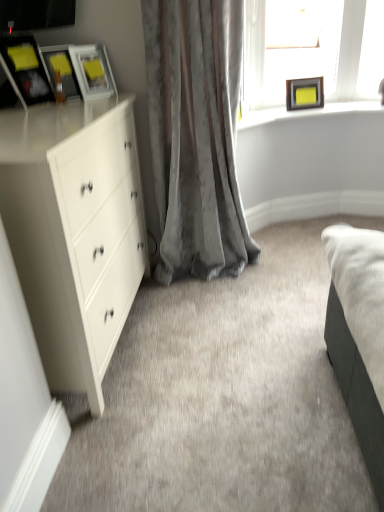
This screenshot has height=512, width=384. Identify the location of free point in front of matte black picture frame at upper left, acting as the second picture frame starting from the left. (66, 104).